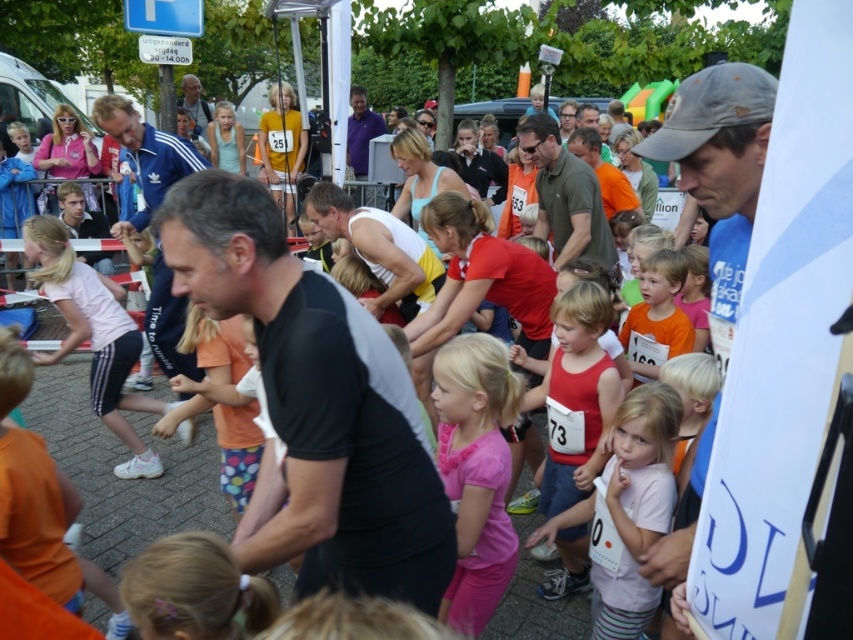
You are standing at the starting line of the race and see two points marked on the track ahead of you. The first point is at coordinates point (682, 113) and the second point is at point (606, 164). Which point is closer to you?

Point (682, 113) is closer to the viewer than point (606, 164).